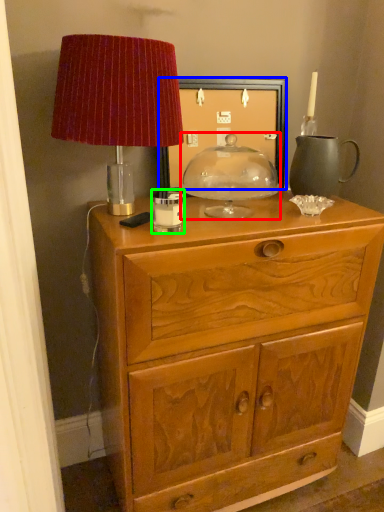
Question: Which is nearer to the candle holder (highlighted by a red box)? picture frame (highlighted by a blue box) or candle holder (highlighted by a green box).

Choices:
 (A) picture frame
 (B) candle holder

Answer: (A)